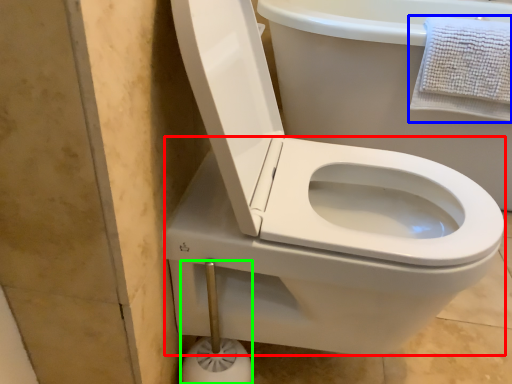
Question: Which object is positioned closest to bidet (highlighted by a red box)? Select from bath towel (highlighted by a blue box) and towel bar (highlighted by a green box).

Choices:
 (A) bath towel
 (B) towel bar

Answer: (B)